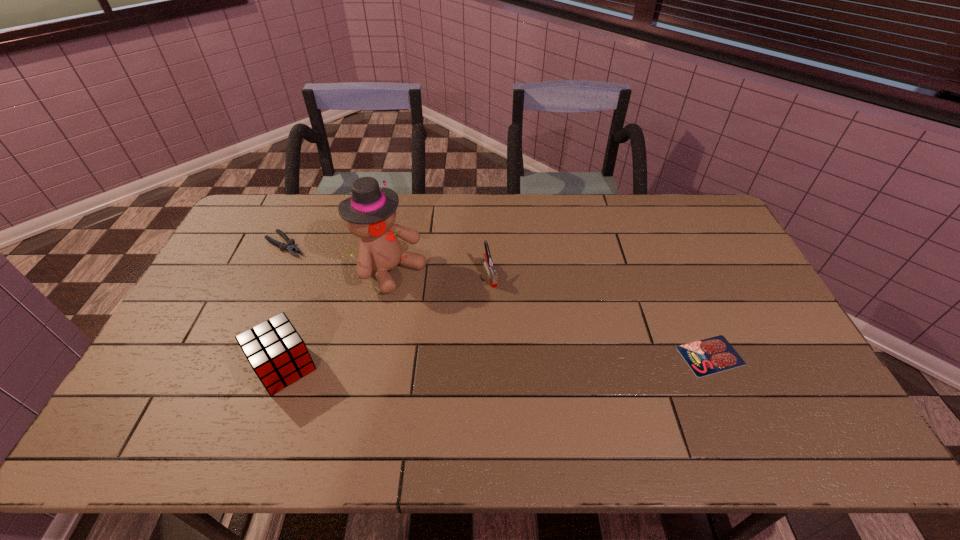
This screenshot has height=540, width=960. Identify the location of free space on the desktop that is between the second tallest object and the salami and is positioned on the front-facing side of the third object from left to right. (546, 360).

The height and width of the screenshot is (540, 960). In order to click on free space on the desktop that is between the fourth shortest object and the rightmost object and is positioned on the handle side of the third shortest object in this screenshot , I will do (x=526, y=361).

Locate an element on the screen. free spot on the desktop that is between the fourth shortest object and the rightmost object and is positioned at the gripping part of the pliers is located at coordinates (444, 363).